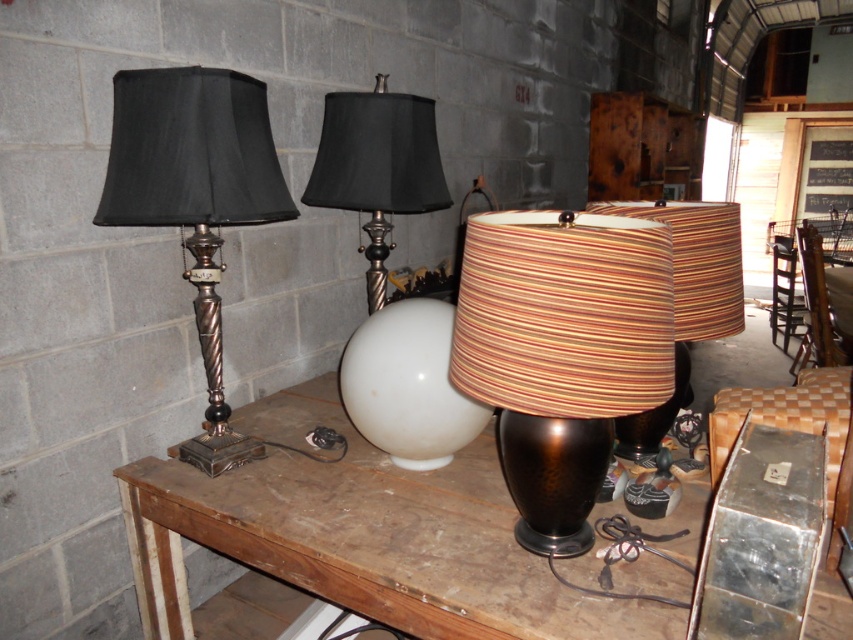
In the scene shown: Who is higher up, matte black lampshade at left or white glossy sphere at center?

matte black lampshade at left is above.

Is matte black lampshade at left closer to the viewer compared to white glossy sphere at center?

Yes, matte black lampshade at left is closer to the viewer.

Does point (210, 387) lie in front of point (403, 403)?

No, it is behind (403, 403).

Identify the location of matte black lampshade at left. (195, 198).

Which of these two, white glossy sphere at center or striped fabric lampshade at center, stands taller?

striped fabric lampshade at center

The image size is (853, 640). What are the coordinates of `white glossy sphere at center` in the screenshot? It's located at (408, 385).

Is brown striped lampshade at center behind matte black lampshade at left?

That is False.

Is point (592, 332) positioned in front of point (207, 298)?

Yes, it is in front of point (207, 298).

Who is more distant from viewer, [543,493] or [221,106]?

The point [221,106] is more distant.

The image size is (853, 640). In order to click on brown striped lampshade at center in this screenshot , I will do `click(561, 353)`.